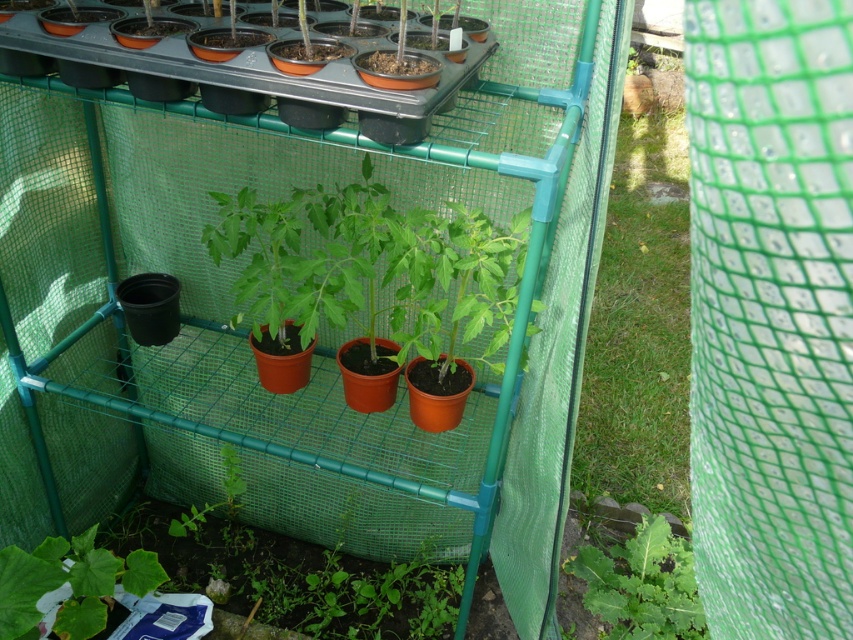
You are a gardener checking the plants in the greenhouse. You notice the green mesh at center and the green matte leaf at lower left. Which object is larger in size?

The green mesh at center is bigger than the green matte leaf at lower left according to the description.

You are a gardener who wants to water the green leafy plant at lower right. Since the greenhouse has a green mesh at center, will the water from the watering can reach the plant without getting blocked?

The green mesh at center is located above the green leafy plant at lower right, so water from the watering can can pass through the mesh and reach the plant without obstruction.